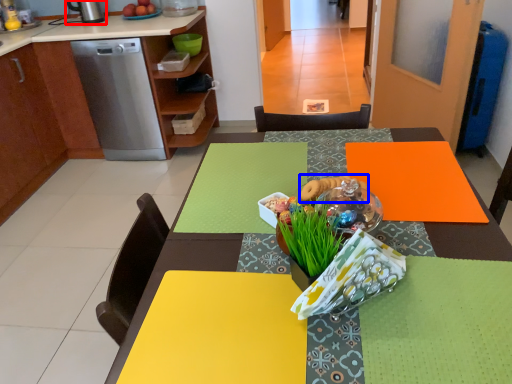
Question: Which object appears farthest to the camera in this image, kitchen appliance (highlighted by a red box) or food (highlighted by a blue box)?

Choices:
 (A) kitchen appliance
 (B) food

Answer: (A)